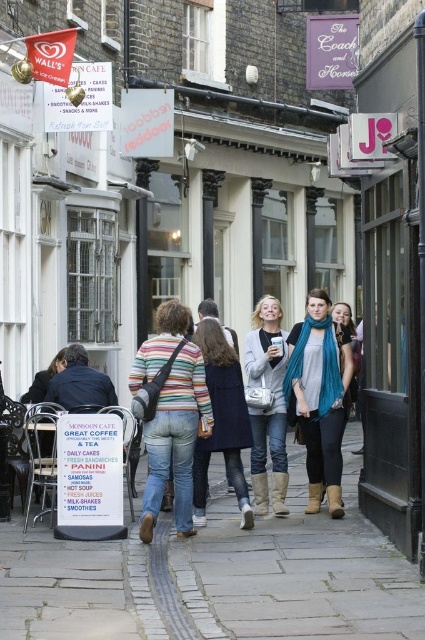
You are standing in the Monsoon Cafe area and want to sit down. There is a gray stone pavement at center and a striped cotton sweater at center. Which object is closer to the right side of the cafe?

The gray stone pavement at center is to the right of the striped cotton sweater at center, so the gray stone pavement at center is closer to the right side of the cafe.

In the scene shown: You are a customer at Monsoon Cafe and you want to pick up your striped cotton sweater at center and leather boots at center. Which item is easier to reach without moving the other?

The striped cotton sweater at center is easier to reach because it is positioned under the leather boots at center, so you can access it without moving the boots.

You are a customer at the Monsoon Cafe and notice two items hanging on the coat rack at the center of the cafe. The items are the striped cotton sweater at center and the teal scarf at center. Which item is positioned to the right?

The teal scarf at center is positioned to the right of the striped cotton sweater at center.